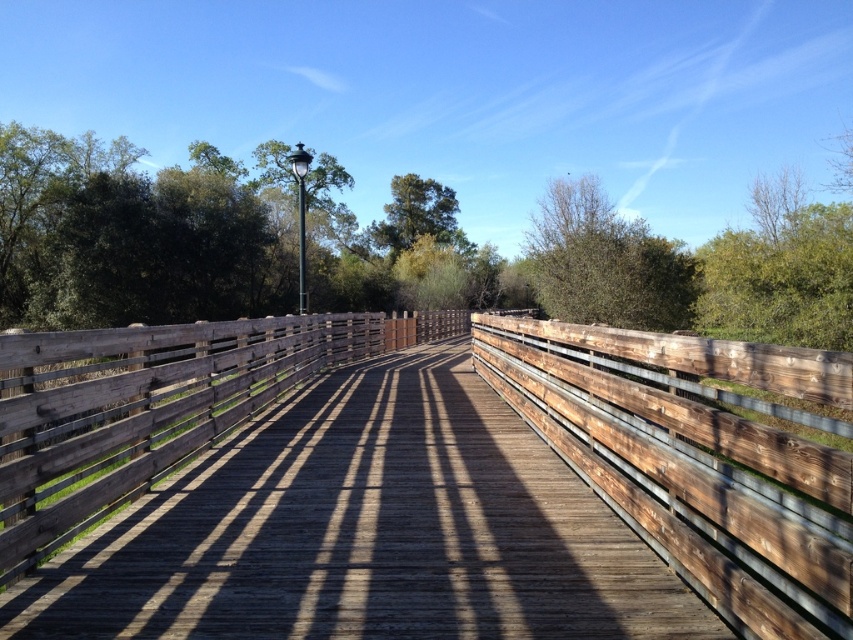
You are standing on the weathered wood bridge at center and want to take a photo of the green matte tree at center. Since the bridge is in the way, will the tree be visible in your photo?

The weathered wood bridge at center is in front of the green matte tree at center, so the tree will be partially or fully blocked by the bridge in your photo.

Based on the photo, you are standing at the starting point of the bridge and want to reach the end. Given the coordinates of the weathered wood bridge at center, can you estimate the direction you should walk to reach the end of the bridge?

The weathered wood bridge at center is located at point (366,531). Since the bridge extends into the distance, you should walk towards the direction where the bridge continues, which would be away from the starting point towards the coordinates provided.

You are standing on the wooden bridge and looking towards the distant end. There are two points marked on the bridge deck, one at coordinates point (780, 225) and the other at point (450, 196). Which point is closer to you?

Point (780, 225) is closer to the camera than point (450, 196), so the point at coordinates point (780, 225) is closer to you.